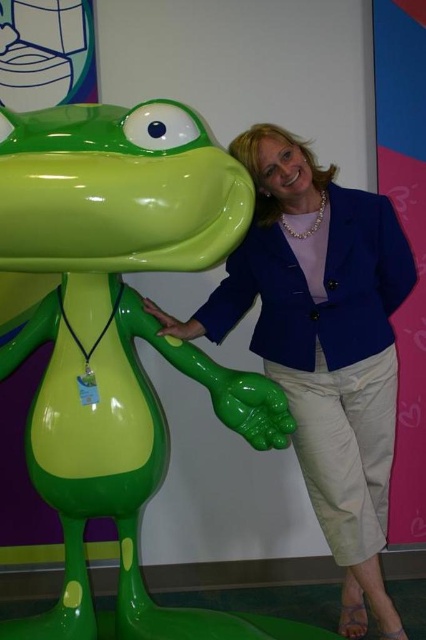
Question: Which point is farther to the camera?

Choices:
 (A) (296, 272)
 (B) (135, 492)

Answer: (A)

Question: Is glossy plastic frog at center below matte green statue at center?

Choices:
 (A) yes
 (B) no

Answer: (A)

Question: Is glossy plastic frog at center thinner than matte green statue at center?

Choices:
 (A) yes
 (B) no

Answer: (A)

Question: Among these objects, which one is nearest to the camera?

Choices:
 (A) matte green statue at center
 (B) glossy plastic frog at center

Answer: (B)

Question: Is glossy plastic frog at center below matte green statue at center?

Choices:
 (A) no
 (B) yes

Answer: (B)